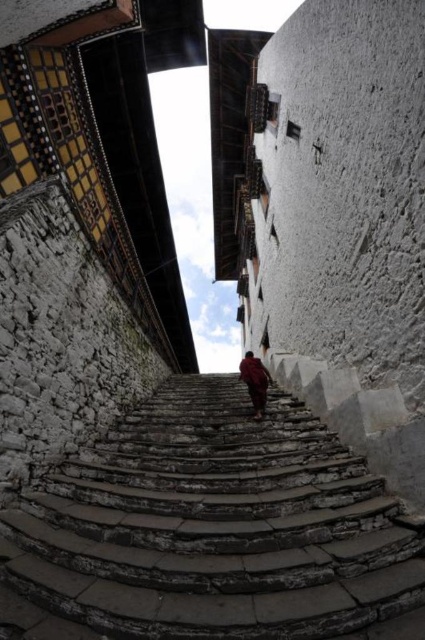
Is stone stairs at center below red woolen robe at center?

Indeed, stone stairs at center is positioned under red woolen robe at center.

Who is lower down, stone stairs at center or red woolen robe at center?

stone stairs at center is below.

The height and width of the screenshot is (640, 425). Identify the location of stone stairs at center. (209, 529).